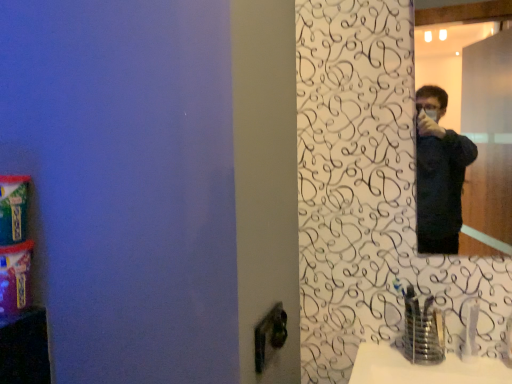
Question: Is white plastic faucet at lower right, which is counted as the second faucet, starting from the left, oriented away from satin nickel faucet at lower right, the first faucet in the left-to-right sequence?

Choices:
 (A) no
 (B) yes

Answer: (A)

Question: From the image's perspective, would you say white plastic faucet at lower right, which is counted as the second faucet, starting from the left, is positioned over satin nickel faucet at lower right, the second faucet positioned from the right?

Choices:
 (A) yes
 (B) no

Answer: (B)

Question: Could satin nickel faucet at lower right, the second faucet positioned from the right, be considered to be inside white plastic faucet at lower right, which is counted as the second faucet, starting from the left?

Choices:
 (A) yes
 (B) no

Answer: (B)

Question: Could you tell me if white plastic faucet at lower right, which is counted as the second faucet, starting from the left, is facing satin nickel faucet at lower right, the second faucet positioned from the right?

Choices:
 (A) no
 (B) yes

Answer: (A)

Question: Is white plastic faucet at lower right, which is counted as the second faucet, starting from the left, at the right side of satin nickel faucet at lower right, the second faucet positioned from the right?

Choices:
 (A) yes
 (B) no

Answer: (A)

Question: In the image, is white plastic faucet at lower right, which is counted as the second faucet, starting from the left, on the left side or the right side of black matte mirror at upper right?

Choices:
 (A) right
 (B) left

Answer: (A)

Question: Which is correct: white plastic faucet at lower right, which is counted as the second faucet, starting from the left, is inside black matte mirror at upper right, or outside of it?

Choices:
 (A) inside
 (B) outside

Answer: (B)

Question: Considering their positions, is white plastic faucet at lower right, which is counted as the second faucet, starting from the left, located in front of or behind black matte mirror at upper right?

Choices:
 (A) front
 (B) behind

Answer: (B)

Question: Does point (472, 307) appear closer or farther from the camera than point (468, 235)?

Choices:
 (A) closer
 (B) farther

Answer: (A)

Question: In terms of height, does satin nickel faucet at lower right, the second faucet positioned from the right, look taller or shorter compared to black matte mirror at upper right?

Choices:
 (A) tall
 (B) short

Answer: (B)

Question: Is point (415, 292) positioned closer to the camera than point (502, 79)?

Choices:
 (A) farther
 (B) closer

Answer: (B)

Question: Considering the positions of satin nickel faucet at lower right, the first faucet in the left-to-right sequence, and black matte mirror at upper right in the image, is satin nickel faucet at lower right, the first faucet in the left-to-right sequence, bigger or smaller than black matte mirror at upper right?

Choices:
 (A) big
 (B) small

Answer: (A)

Question: Considering the positions of satin nickel faucet at lower right, the second faucet positioned from the right, and black matte mirror at upper right in the image, is satin nickel faucet at lower right, the second faucet positioned from the right, wider or thinner than black matte mirror at upper right?

Choices:
 (A) wide
 (B) thin

Answer: (A)

Question: From the image's perspective, is white plastic faucet at lower right, which is counted as the second faucet, starting from the left, above or below satin nickel faucet at lower right, the first faucet in the left-to-right sequence?

Choices:
 (A) above
 (B) below

Answer: (B)

Question: Looking at the image, does white plastic faucet at lower right, which is counted as the second faucet, starting from the left, seem bigger or smaller compared to satin nickel faucet at lower right, the first faucet in the left-to-right sequence?

Choices:
 (A) big
 (B) small

Answer: (B)